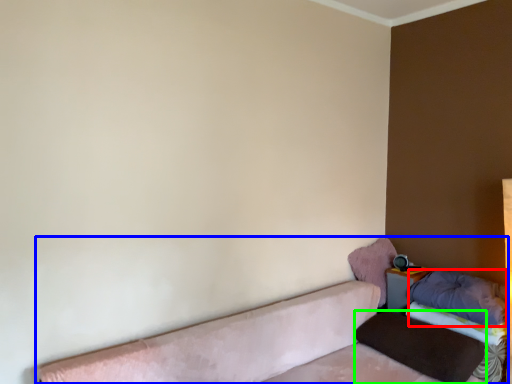
Question: Based on their relative distances, which object is farther from pillow (highlighted by a red box)? Choose from studio couch (highlighted by a blue box) and pillow (highlighted by a green box).

Choices:
 (A) studio couch
 (B) pillow

Answer: (A)